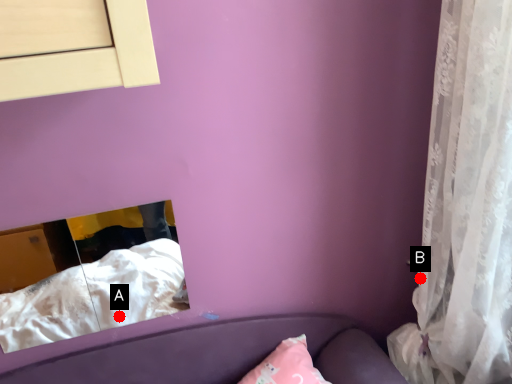
Question: Two points are circled on the image, labeled by A and B beside each circle. Which of the following is the farthest from the observer?

Choices:
 (A) A is further
 (B) B is further

Answer: (A)